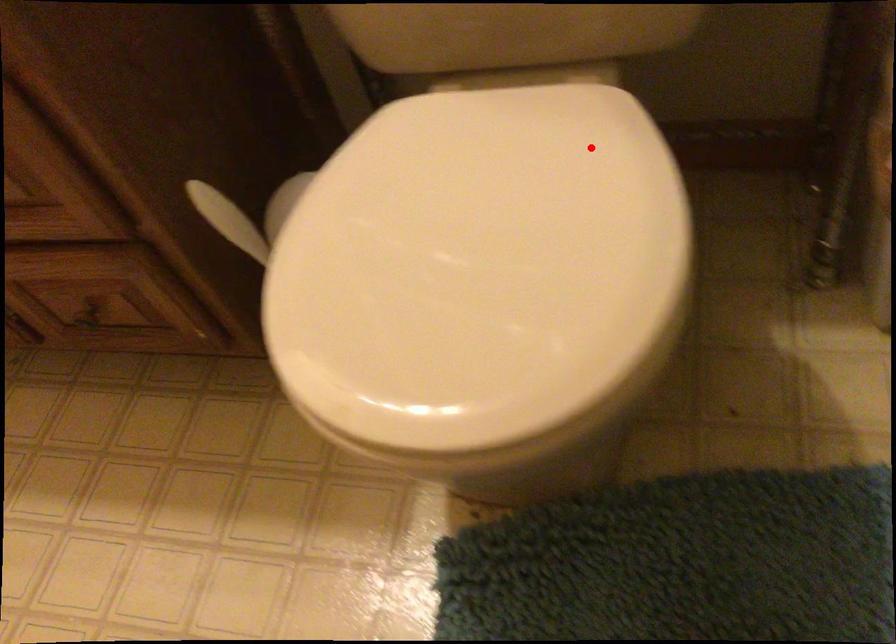
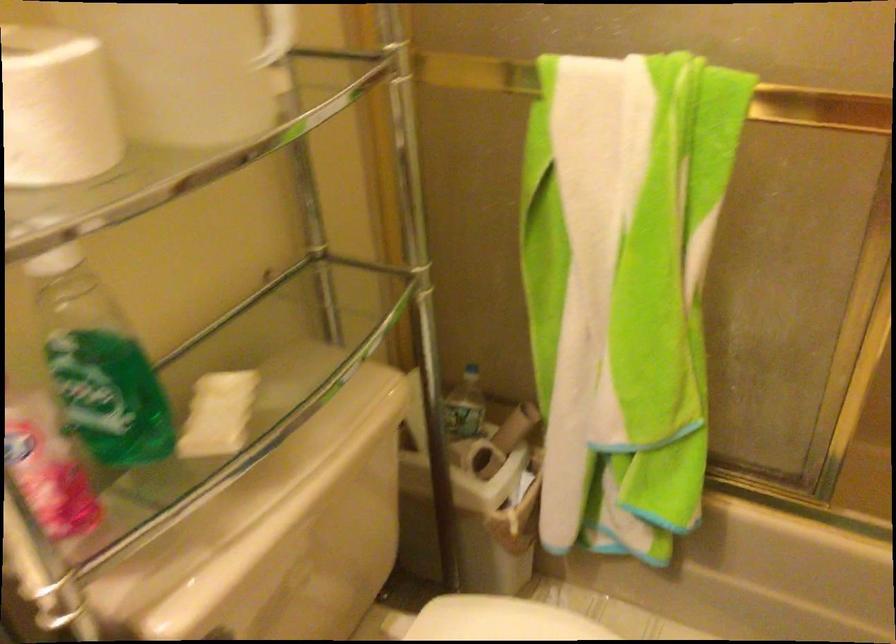
Find the pixel in the second image that matches the highlighted location in the first image.

(500, 620)